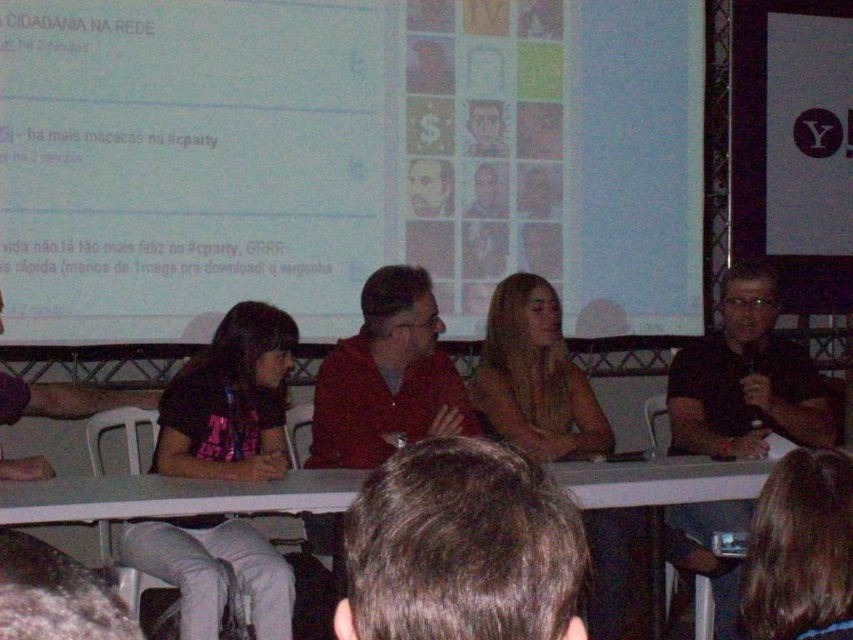
You are a photographer in a dimly lit room preparing to take a photo of the panel discussion. You notice the white matte projection screen at upper center and the brown hair at upper center. Which object should you focus on first to ensure proper exposure, considering their sizes?

The white matte projection screen at upper center is larger in size than brown hair at upper center, so you should focus on the white matte projection screen at upper center first to ensure proper exposure.

You are sitting in the audience and want to identify the panelist with dark brown hair at center. Which direction should you look relative to the pink fabric shirt at center?

The dark brown hair at center is to the right of the pink fabric shirt at center, so you should look to the right of the pink fabric shirt at center to find the panelist with dark brown hair at center.